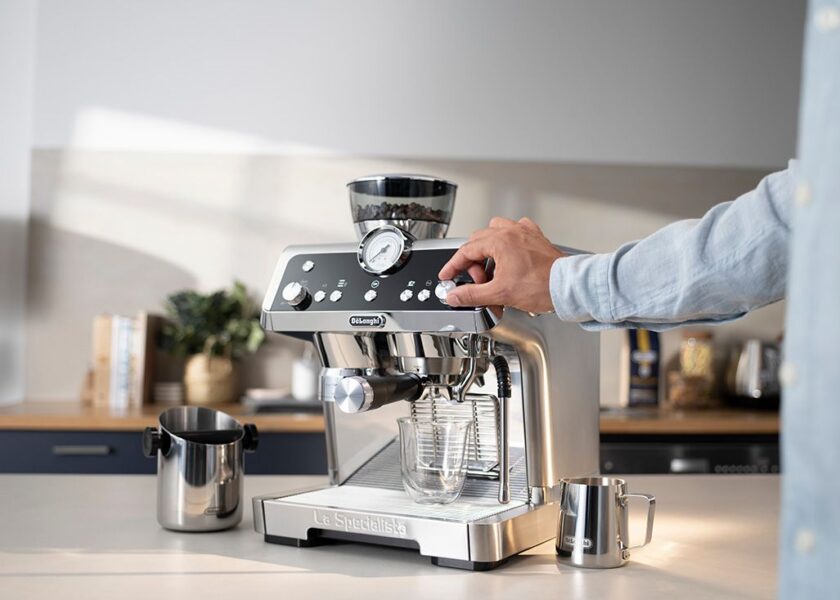
Find the location of a particular element. This screenshot has width=840, height=600. books is located at coordinates (98, 359), (113, 362), (139, 362).